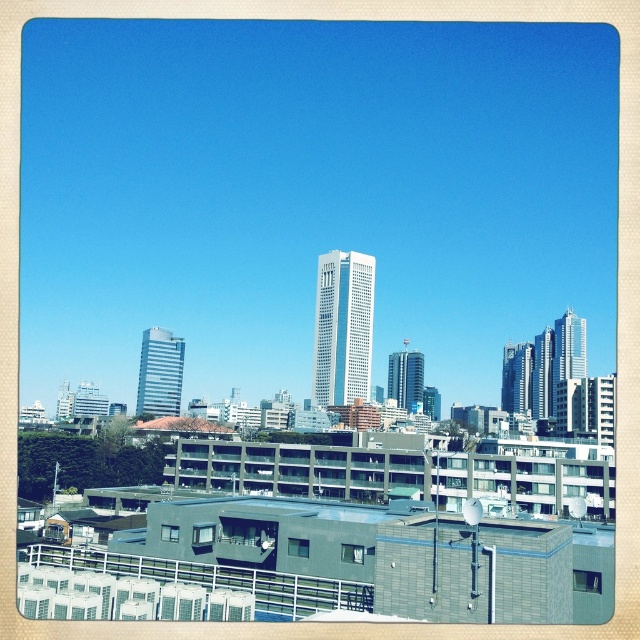
Who is lower down, light gray glass skyscraper at center-left or gray concrete building at center?

light gray glass skyscraper at center-left is lower down.

Which is in front, point (148, 396) or point (509, 362)?

Point (148, 396) is in front.

Find the location of `light gray glass skyscraper at center-left`. light gray glass skyscraper at center-left is located at coordinates (160, 372).

Who is taller, white glass skyscraper at center or sleek glass skyscraper at center?

Standing taller between the two is white glass skyscraper at center.

Which is in front, point (348, 337) or point (388, 385)?

Positioned in front is point (348, 337).

Find the location of a particular element. Image resolution: width=640 pixels, height=640 pixels. white glass skyscraper at center is located at coordinates (342, 326).

Does point (152, 337) lie in front of point (563, 378)?

That is True.

Does light gray glass skyscraper at center-left appear under sleek glass skyscraper at upper right?

Yes.

Image resolution: width=640 pixels, height=640 pixels. What do you see at coordinates (160, 372) in the screenshot?
I see `light gray glass skyscraper at center-left` at bounding box center [160, 372].

You are a GUI agent. You are given a task and a screenshot of the screen. Output one action in this format:
    pyautogui.click(x=<x>, y=<y>)
    Task: Click on the light gray glass skyscraper at center-left
    This screenshot has width=640, height=640.
    Given the screenshot: What is the action you would take?
    [x=160, y=372]